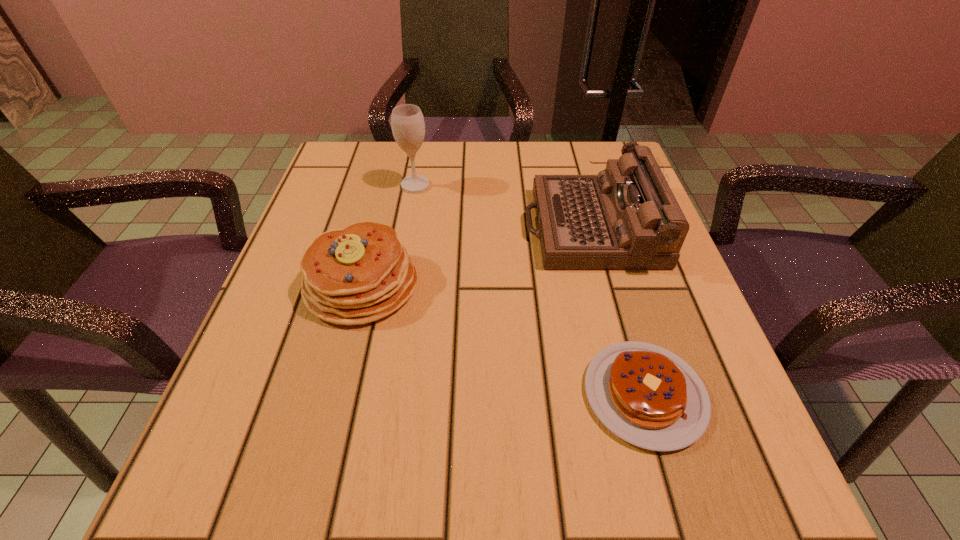
In the image, there is a desktop. At what (x,y) coordinates should I click in order to perform the action: click on free space at the far edge. Please return your answer as a coordinate pair (x, y). The height and width of the screenshot is (540, 960). Looking at the image, I should click on (468, 175).

Locate an element on the screen. This screenshot has width=960, height=540. vacant region at the left edge of the desktop is located at coordinates (372, 207).

Where is `free space at the right edge`? This screenshot has width=960, height=540. free space at the right edge is located at coordinates (659, 333).

Where is `vacant space at the far left corner of the desktop`? This screenshot has height=540, width=960. vacant space at the far left corner of the desktop is located at coordinates (385, 150).

Image resolution: width=960 pixels, height=540 pixels. In the image, there is a desktop. In order to click on vacant space at the near left corner in this screenshot , I will do `click(305, 469)`.

In the image, there is a desktop. At what (x,y) coordinates should I click in order to perform the action: click on vacant space at the far right corner. Please return your answer as a coordinate pair (x, y). The width and height of the screenshot is (960, 540). Looking at the image, I should click on (573, 158).

Where is `vacant space at the near right corner`? vacant space at the near right corner is located at coordinates (729, 464).

What are the coordinates of `vacant area between the second tallest object and the farther pancake` in the screenshot? It's located at (476, 255).

Locate an element on the screen. free space between the tallest object and the right pancake is located at coordinates (530, 290).

Locate an element on the screen. free space between the third shortest object and the farther pancake is located at coordinates (476, 255).